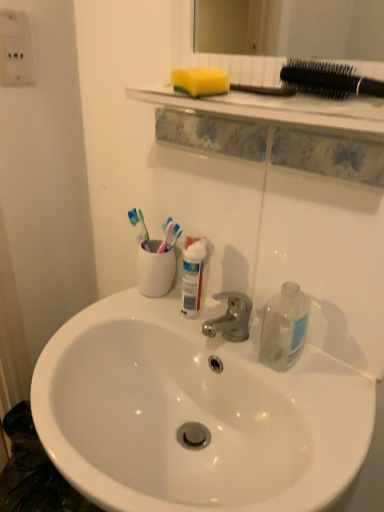
Question: Is point (289, 347) positioned closer to the camera than point (31, 58)?

Choices:
 (A) farther
 (B) closer

Answer: (B)

Question: Looking at the image, does transparent glass bottle at right seem bigger or smaller compared to white plastic electric outlet at upper left?

Choices:
 (A) small
 (B) big

Answer: (B)

Question: Which object is positioned closest to the transparent glass bottle at right?

Choices:
 (A) black plastic hairbrush at upper right
 (B) yellow sponge at upper center
 (C) white glossy tube at center
 (D) white plastic electric outlet at upper left
 (E) white glossy sink at center

Answer: (C)

Question: Based on their relative distances, which object is nearer to the white plastic electric outlet at upper left?

Choices:
 (A) yellow sponge at upper center
 (B) white glossy tube at center
 (C) white glossy sink at center
 (D) transparent glass bottle at right
 (E) black plastic hairbrush at upper right

Answer: (A)